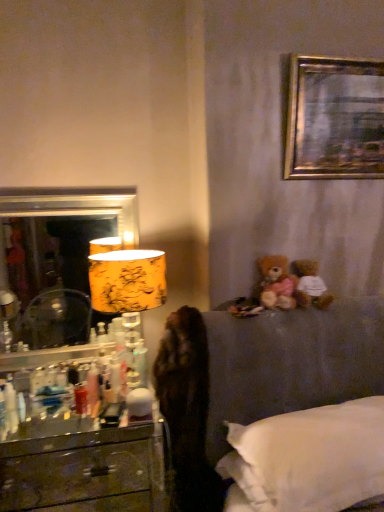
Question: Looking at the image, does wooden drawer at lower left seem bigger or smaller compared to brown plush teddy bear at upper right, acting as the first teddy bear starting from the left?

Choices:
 (A) small
 (B) big

Answer: (A)

Question: Considering the positions of point (8, 483) and point (264, 261), is point (8, 483) closer or farther from the camera than point (264, 261)?

Choices:
 (A) farther
 (B) closer

Answer: (B)

Question: Which is nearer to the gold leaf mirror at left?

Choices:
 (A) wooden drawer at lower left
 (B) gold metallic picture frame at upper right
 (C) white soft pillow at lower right
 (D) brown plush teddy bear at upper right, marked as the 2th teddy bear in a right-to-left arrangement
 (E) yellow floral fabric lampshade at left

Answer: (A)

Question: Based on their relative distances, which object is nearer to the yellow floral fabric lampshade at left?

Choices:
 (A) white plush teddy bear at upper right, marked as the first teddy bear in a right-to-left arrangement
 (B) gold leaf mirror at left
 (C) wooden drawer at lower left
 (D) brown plush teddy bear at upper right, acting as the first teddy bear starting from the left
 (E) white soft pillow at lower right

Answer: (D)